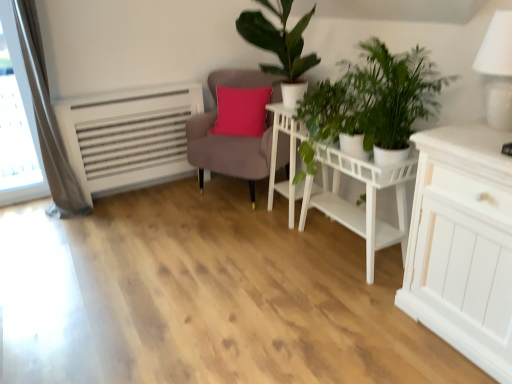
You are a GUI agent. You are given a task and a screenshot of the screen. Output one action in this format:
    pyautogui.click(x=<x>, y=<y>)
    Task: Click on the vacant area that is in front of white matte table at center
    
    Given the screenshot: What is the action you would take?
    pyautogui.click(x=344, y=307)